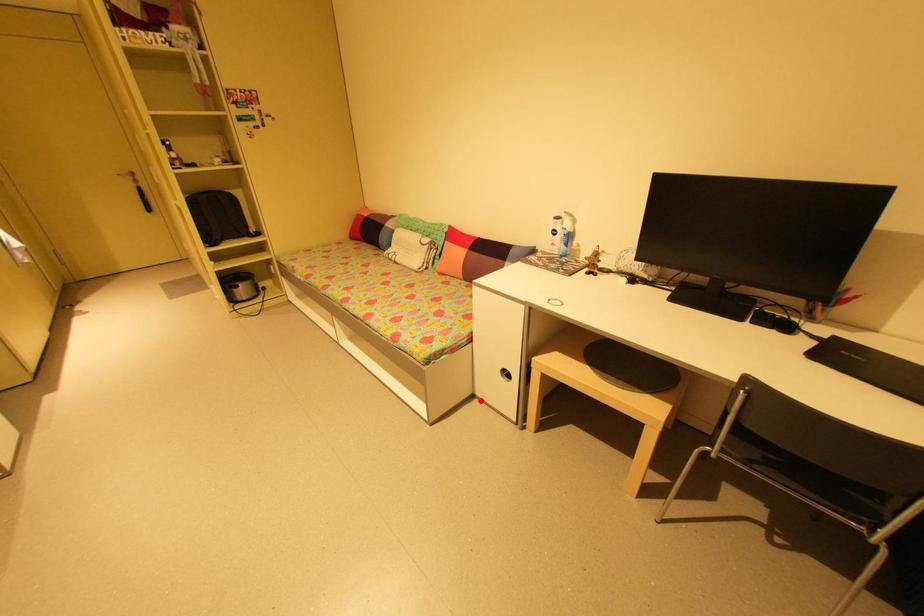
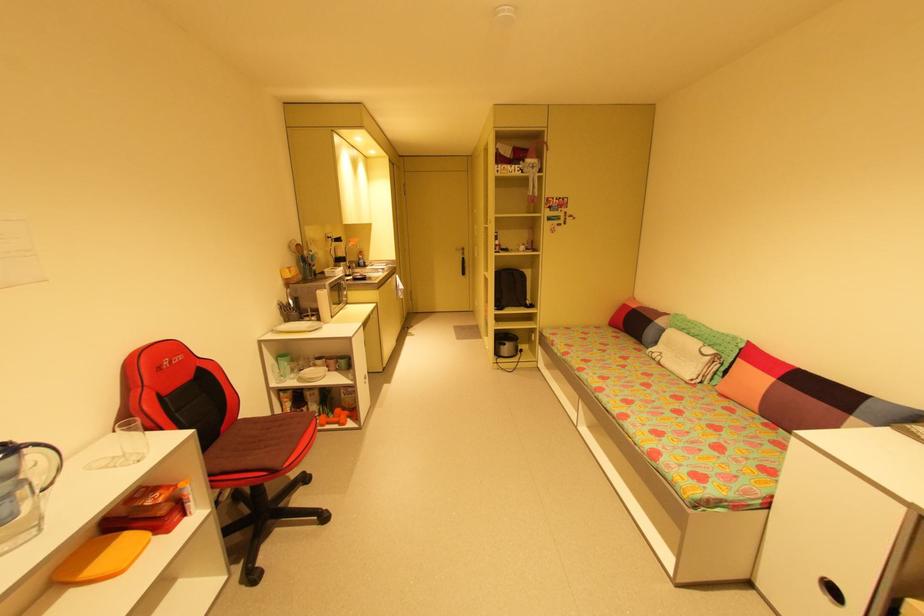
Question: I am providing you with two images of the same scene from different viewpoints. Given a red point in image1, look at the same physical point in image2. Is it:

Choices:
 (A) Closer to the viewpoint
 (B) Farther from the viewpoint

Answer: (A)